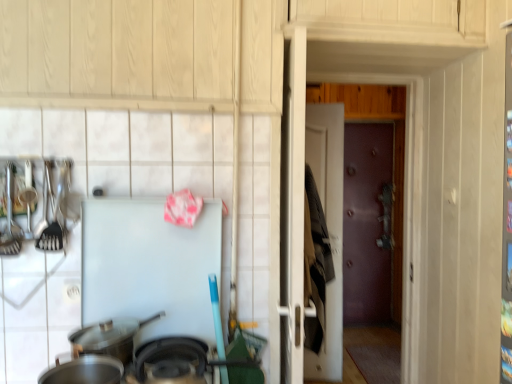
Question: From a real-world perspective, is brown leather door at center, acting as the 1th door starting from the left, under black matte wok at lower center, which appears as the second wok when viewed from the back?

Choices:
 (A) yes
 (B) no

Answer: (A)

Question: Does brown leather door at center, which is the first door from front to back, have a greater height compared to black matte wok at lower center, which appears as the second wok when viewed from the back?

Choices:
 (A) yes
 (B) no

Answer: (A)

Question: Is brown leather door at center, acting as the 1th door starting from the left, touching black matte wok at lower center, which appears as the second wok when viewed from the back?

Choices:
 (A) yes
 (B) no

Answer: (B)

Question: Considering the relative sizes of brown leather door at center, acting as the 1th door starting from the left, and black matte wok at lower center, which appears as the second wok when viewed from the back, in the image provided, is brown leather door at center, acting as the 1th door starting from the left, shorter than black matte wok at lower center, which appears as the second wok when viewed from the back,?

Choices:
 (A) no
 (B) yes

Answer: (A)

Question: Could you tell me if brown leather door at center, acting as the 1th door starting from the left, is facing black matte wok at lower center, which appears as the second wok when viewed from the back?

Choices:
 (A) yes
 (B) no

Answer: (B)

Question: Is point (154, 291) positioned closer to the camera than point (0, 235)?

Choices:
 (A) farther
 (B) closer

Answer: (A)

Question: Based on their positions, is white matte refrigerator at center located to the left or right of shiny metallic spoon at left?

Choices:
 (A) right
 (B) left

Answer: (A)

Question: Is white matte refrigerator at center taller or shorter than shiny metallic spoon at left?

Choices:
 (A) tall
 (B) short

Answer: (A)

Question: From the image's perspective, relative to shiny metallic spoon at left, is white matte refrigerator at center above or below?

Choices:
 (A) below
 (B) above

Answer: (A)

Question: From their relative heights in the image, would you say silver metallic wok at lower left, the 3th wok from the front, is taller or shorter than brown leather door at center, the second door when ordered from right to left?

Choices:
 (A) tall
 (B) short

Answer: (B)

Question: From a real-world perspective, is silver metallic wok at lower left, the 3th wok from the front, physically located above or below brown leather door at center, the 2th door viewed from the back?

Choices:
 (A) below
 (B) above

Answer: (B)

Question: Choose the correct answer: Is silver metallic wok at lower left, which is the first wok from back to front, inside brown leather door at center, the 2th door viewed from the back, or outside it?

Choices:
 (A) inside
 (B) outside

Answer: (B)

Question: Based on their positions, is silver metallic wok at lower left, the 3th wok from the front, located to the left or right of brown leather door at center, the 2th door viewed from the back?

Choices:
 (A) right
 (B) left

Answer: (B)

Question: Would you say shiny metallic spoon at left is to the left or to the right of white matte refrigerator at center in the picture?

Choices:
 (A) right
 (B) left

Answer: (B)

Question: Considering the positions of shiny metallic spoon at left and white matte refrigerator at center in the image, is shiny metallic spoon at left wider or thinner than white matte refrigerator at center?

Choices:
 (A) wide
 (B) thin

Answer: (A)